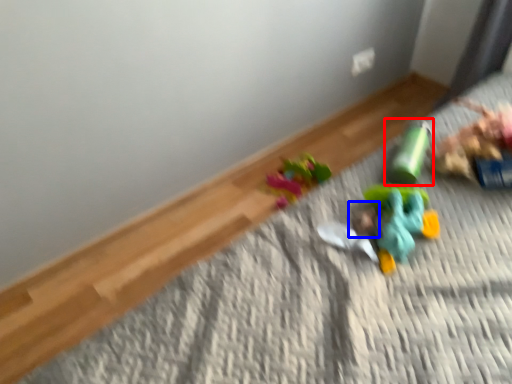
Question: Which object is closer to the camera taking this photo, toy (highlighted by a red box) or head (highlighted by a blue box)?

Choices:
 (A) toy
 (B) head

Answer: (B)